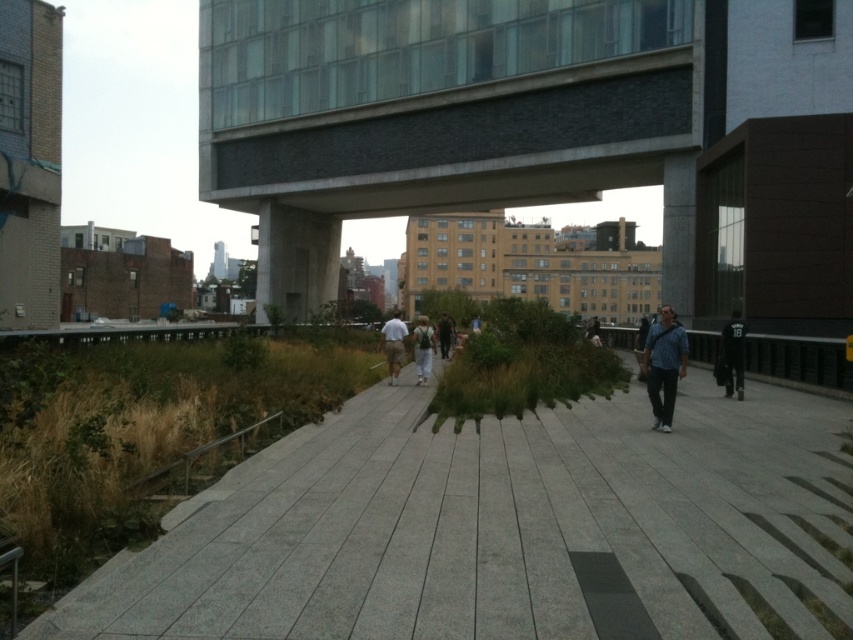
You are a photographer standing on the rooftop garden and want to capture both the dark blue jersey at center and the light gray fabric jacket at center in a single photo. What is the minimum distance you need to move back to ensure both are in frame?

The dark blue jersey at center and light gray fabric jacket at center are 9.47 meters apart from each other. To capture both in a single photo, you need to move back at least 9.47 meters to ensure the entire distance between them fits within the camera frame.

You are a delivery person carrying a large box that is 1.2 meters wide. You need to navigate through the gray concrete pavement at center and the blue denim jacket at right. Can your box fit through the narrowest point between them?

The gray concrete pavement at center might be wider than blue denim jacket at right, so the narrowest point is likely the blue denim jacket at right. Since the box is 1.2 meters wide, it depends on the actual width of the narrowest point. Without exact measurements, it is uncertain if the box will fit.

You are standing at the point labeled point (152, 577) and want to walk to the point labeled point (431, 346). Which direction should you move to get closer to your destination?

You should move away from the viewer to reach point (431, 346) since point (152, 577) is closer to the viewer than point (431, 346).